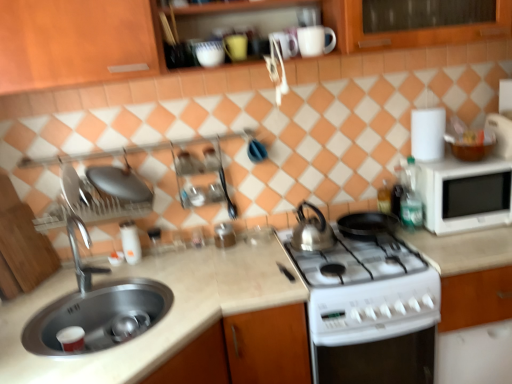
Measure the distance between white glossy salt shaker at center, which is the first appliance from left to right, and camera.

white glossy salt shaker at center, which is the first appliance from left to right, is 5.90 feet from camera.

The height and width of the screenshot is (384, 512). Describe the element at coordinates (130, 242) in the screenshot. I see `white glossy salt shaker at center, the second appliance viewed from the right` at that location.

The width and height of the screenshot is (512, 384). What do you see at coordinates (97, 308) in the screenshot?
I see `silver metallic sink at lower left` at bounding box center [97, 308].

What is the approximate height of silver metallic tap at sink left?

The height of silver metallic tap at sink left is 14.16 inches.

Locate an element on the screen. satin silver kettle at center is located at coordinates (312, 231).

Measure the distance between point (497, 346) and camera.

Point (497, 346) and camera are 1.78 meters apart from each other.

Identify the location of white glossy salt shaker at center, which is the first appliance from left to right. The height and width of the screenshot is (384, 512). (130, 242).

Is beige marble countertop at center not close to satin silver kettle at center?

No, there isn't a large distance between beige marble countertop at center and satin silver kettle at center.

Is beige marble countertop at center aimed at satin silver kettle at center?

No, beige marble countertop at center is not aimed at satin silver kettle at center.

Locate an element on the screen. countertop below the satin silver kettle at center (from a real-world perspective) is located at coordinates (162, 319).

Between beige marble countertop at center and satin silver kettle at center, which one has smaller width?

satin silver kettle at center is thinner.

Where is `tea pot in front of the translucent plastic bottle at stove right, positioned as the second bottle in front-to-back order`? tea pot in front of the translucent plastic bottle at stove right, positioned as the second bottle in front-to-back order is located at coordinates (312, 231).

Is point (388, 188) closer to camera compared to point (304, 246)?

No, (388, 188) is behind (304, 246).

Is translucent plastic bottle at stove right, marked as the first bottle in a back-to-front arrangement, looking in the opposite direction of satin silver kettle at center?

translucent plastic bottle at stove right, marked as the first bottle in a back-to-front arrangement, does not have its back to satin silver kettle at center.

Between point (509, 23) and point (387, 195), which one is positioned in front?

The point (509, 23) is closer.

From the image's perspective, relative to translucent plastic bottle at stove right, positioned as the second bottle in front-to-back order, is wooden cabinet at upper center above or below?

Clearly, from the image's perspective, wooden cabinet at upper center is above translucent plastic bottle at stove right, positioned as the second bottle in front-to-back order.

Is wooden cabinet at upper center inside or outside of translucent plastic bottle at stove right, marked as the first bottle in a back-to-front arrangement?

wooden cabinet at upper center is spatially situated outside translucent plastic bottle at stove right, marked as the first bottle in a back-to-front arrangement.

Would you say silver metallic sink at lower left is outside silver metallic tap at sink left?

silver metallic sink at lower left is positioned outside silver metallic tap at sink left.

Which of these two, silver metallic sink at lower left or silver metallic tap at sink left, is thinner?

silver metallic tap at sink left is thinner.

Which object is more forward, silver metallic sink at lower left or silver metallic tap at sink left?

silver metallic sink at lower left is in front.

Is white glossy stove at lower center aimed at glossy ceramic mug at upper center, which appears as the 2th mug when viewed from the right?

No, white glossy stove at lower center is not aimed at glossy ceramic mug at upper center, which appears as the 2th mug when viewed from the right.

Is white glossy stove at lower center not near glossy ceramic mug at upper center, the 1th mug in the left-to-right sequence?

Yes, white glossy stove at lower center and glossy ceramic mug at upper center, the 1th mug in the left-to-right sequence, are quite far apart.

From a real-world perspective, is white glossy stove at lower center physically above glossy ceramic mug at upper center, the 1th mug in the left-to-right sequence?

No, from a real-world perspective, white glossy stove at lower center is not over glossy ceramic mug at upper center, the 1th mug in the left-to-right sequence

Measure the distance between white glossy stove at lower center and glossy ceramic mug at upper center, the 1th mug in the left-to-right sequence.

white glossy stove at lower center is 1.08 meters away from glossy ceramic mug at upper center, the 1th mug in the left-to-right sequence.

From the image's perspective, is white matte microwave at right above or below glossy ceramic mug at upper center, which appears as the 2th mug when viewed from the right?

Clearly, from the image's perspective, white matte microwave at right is below glossy ceramic mug at upper center, which appears as the 2th mug when viewed from the right.

Based on the photo, is white matte microwave at right to the right of glossy ceramic mug at upper center, which appears as the 2th mug when viewed from the right, from the viewer's perspective?

Indeed, white matte microwave at right is positioned on the right side of glossy ceramic mug at upper center, which appears as the 2th mug when viewed from the right.

From a real-world perspective, is white matte microwave at right above or below glossy ceramic mug at upper center, which appears as the 2th mug when viewed from the right?

From a real-world perspective, white matte microwave at right is physically below glossy ceramic mug at upper center, which appears as the 2th mug when viewed from the right.

From the image's perspective, count 1st mugs upward from the white matte microwave at right and point to it. Please provide its 2D coordinates.

[(285, 44)]

Considering the relative sizes of green glass bottle at right, which is the 1th bottle from front to back, and white glossy stove at lower center in the image provided, is green glass bottle at right, which is the 1th bottle from front to back, wider than white glossy stove at lower center?

No, green glass bottle at right, which is the 1th bottle from front to back, is not wider than white glossy stove at lower center.

Between green glass bottle at right, the second bottle positioned from the back, and white glossy stove at lower center, which one has smaller size?

green glass bottle at right, the second bottle positioned from the back.

Is green glass bottle at right, the second bottle positioned from the back, to the left or to the right of white glossy stove at lower center in the image?

Clearly, green glass bottle at right, the second bottle positioned from the back, is on the right of white glossy stove at lower center in the image.

From a real-world perspective, is green glass bottle at right, which is the 1th bottle from front to back, over white glossy stove at lower center?

Correct, in the physical world, green glass bottle at right, which is the 1th bottle from front to back, is higher than white glossy stove at lower center.

Where is `countertop in front of the satin silver kettle at center`? countertop in front of the satin silver kettle at center is located at coordinates (162, 319).

In the image, there is a translucent plastic bottle at stove right, positioned as the second bottle in front-to-back order. Identify the location of tea pot below it (from a real-world perspective). The width and height of the screenshot is (512, 384). (312, 231).

Considering their positions, is wooden cabinet at upper center positioned further to beige marble countertop at center than white glossy stove at lower center?

The object further to beige marble countertop at center is wooden cabinet at upper center.

When comparing their distances from translucent plastic bottle at stove right, marked as the first bottle in a back-to-front arrangement, does glossy ceramic mug at upper center, the 1th mug in the left-to-right sequence, or silver metallic tap at sink left seem closer?

glossy ceramic mug at upper center, the 1th mug in the left-to-right sequence, is positioned closer to the anchor translucent plastic bottle at stove right, marked as the first bottle in a back-to-front arrangement.

Which object lies nearer to the anchor point white matte microwave at right, glossy ceramic mug at upper center, the 1th mug in the left-to-right sequence, or white matte countertop at center?

white matte countertop at center.

Based on their spatial positions, is translucent plastic bottle at stove right, marked as the first bottle in a back-to-front arrangement, or white glossy stove at lower center further from satin silver kettle at center?

Among the two, translucent plastic bottle at stove right, marked as the first bottle in a back-to-front arrangement, is located further to satin silver kettle at center.

Looking at the image, which one is located further to silver metallic tap at sink left, satin silver kettle at center or white glossy salt shaker at center, the second appliance viewed from the right?

satin silver kettle at center.

Based on their spatial positions, is wooden cabinet at upper center or white glossy stove at lower center further from satin silver kettle at center?

Based on the image, wooden cabinet at upper center appears to be further to satin silver kettle at center.

Estimate the real-world distances between objects in this image. Which object is closer to white glossy stove at lower center, metallic silver canister at center, positioned as the 2th appliance in left-to-right order, or white matte countertop at center?

white matte countertop at center.

Looking at the image, which one is located further to white matte microwave at right, wooden cabinet at upper center or beige marble countertop at center?

Among the two, beige marble countertop at center is located further to white matte microwave at right.

In order to click on kitchen appliance between metallic silver canister at center, which appears as the 1th appliance when viewed from the right, and translucent plastic bottle at stove right, positioned as the second bottle in front-to-back order, in the horizontal direction in this screenshot , I will do [369, 311].

Where is `tea pot located between metallic silver canister at center, which appears as the 1th appliance when viewed from the right, and white matte countertop at center in the left-right direction`? The image size is (512, 384). tea pot located between metallic silver canister at center, which appears as the 1th appliance when viewed from the right, and white matte countertop at center in the left-right direction is located at coordinates (312, 231).

Find the location of `tea pot between white glossy mug at upper center, the second mug when ordered from left to right, and silver metallic sink at lower left in the up-down direction`. tea pot between white glossy mug at upper center, the second mug when ordered from left to right, and silver metallic sink at lower left in the up-down direction is located at coordinates (312, 231).

What are the coordinates of `mug between white glossy mug at upper center, the first mug viewed from the right, and metallic silver canister at center, positioned as the 2th appliance in left-to-right order, vertically` in the screenshot? It's located at (285, 44).